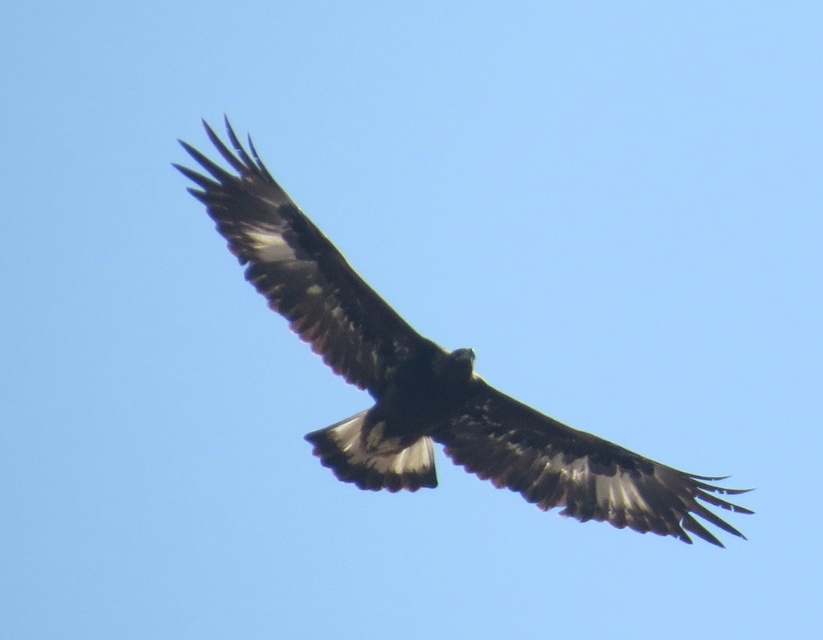
You are a wildlife photographer trying to capture a clear photo of the brown feathered eagle at center and the dark brown feathered wing at center. Which object should you focus on if you want to highlight the larger subject in your shot?

The brown feathered eagle at center is bigger than the dark brown feathered wing at center, so you should focus on the brown feathered eagle at center to highlight the larger subject in your shot.

Consider the image. You are a photographer trying to capture the brown feathered eagle at center in the center of your photo. The camera has a grid overlay with a central crosshair at coordinates 0.5,0.5. Is the eagle already centered in the frame?

The 2D location of brown feathered eagle at center is at point (426,380), which is slightly to the right and slightly below the camera grid overlay central crosshair at (411,320). Therefore, the eagle is not perfectly centered in the frame.